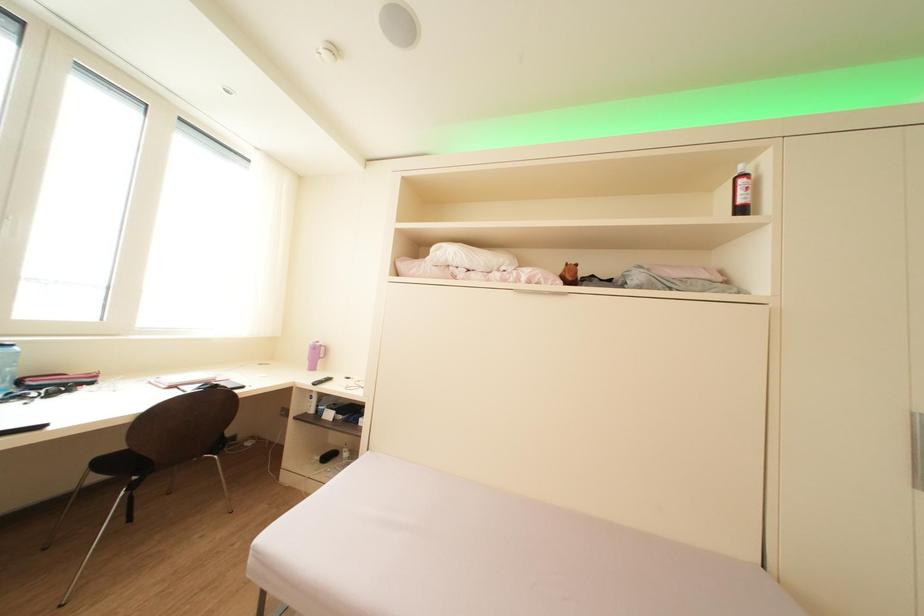
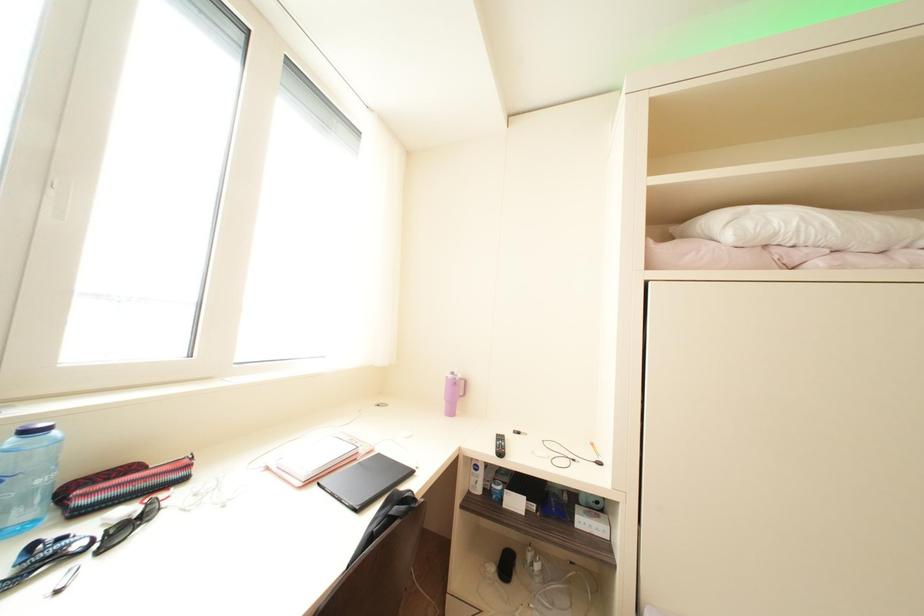
The images are taken continuously from a first-person perspective. In which direction are you moving?

The cameraman walked toward left, forward.